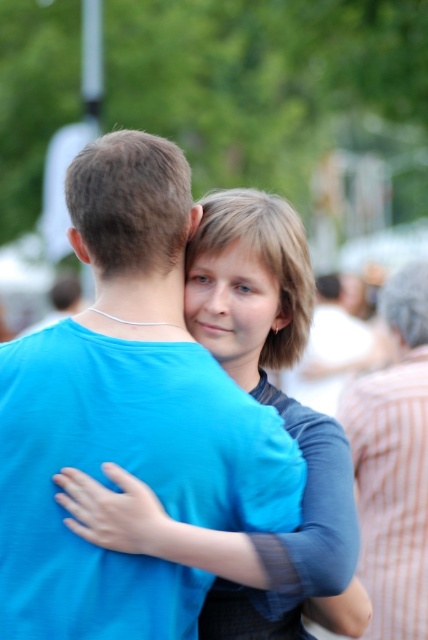
In the scene shown: Can you confirm if blue matte shirt at center is bigger than striped cotton shirt at right?

No, blue matte shirt at center is not bigger than striped cotton shirt at right.

Which is behind, point (14, 634) or point (400, 602)?

Positioned behind is point (400, 602).

Who is more distant from viewer, (168, 412) or (389, 317)?

The point (389, 317) is behind.

You are a GUI agent. You are given a task and a screenshot of the screen. Output one action in this format:
    pyautogui.click(x=<x>, y=<y>)
    Task: Click on the blue matte shirt at center
    This screenshot has height=640, width=428.
    Given the screenshot: What is the action you would take?
    pyautogui.click(x=127, y=416)